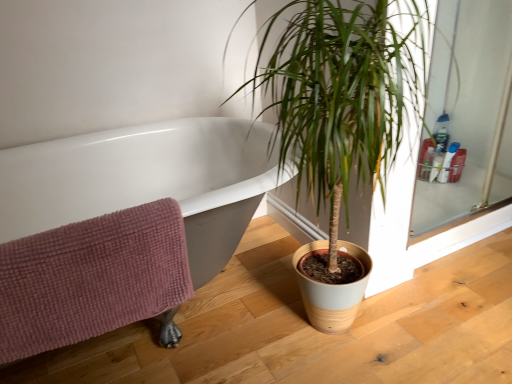
Question: Could you tell me if green leafy plant at center is facing translucent plastic bottles at upper right, the 2th toiletry in the right-to-left sequence?

Choices:
 (A) yes
 (B) no

Answer: (B)

Question: Would you say green leafy plant at center is a long distance from translucent plastic bottles at upper right, positioned as the second toiletry in left-to-right order?

Choices:
 (A) yes
 (B) no

Answer: (A)

Question: From a real-world perspective, is green leafy plant at center under translucent plastic bottles at upper right, the 2th toiletry in the right-to-left sequence?

Choices:
 (A) yes
 (B) no

Answer: (B)

Question: Is green leafy plant at center with translucent plastic bottles at upper right, the 2th toiletry in the right-to-left sequence?

Choices:
 (A) yes
 (B) no

Answer: (B)

Question: Does green leafy plant at center have a greater width compared to translucent plastic bottles at upper right, the 2th toiletry in the right-to-left sequence?

Choices:
 (A) no
 (B) yes

Answer: (B)

Question: Looking at the image, does translucent plastic bottles at upper right, acting as the third toiletry starting from the right, seem bigger or smaller compared to pink waffle-textured towel at lower left?

Choices:
 (A) big
 (B) small

Answer: (B)

Question: Does point (435, 160) appear closer or farther from the camera than point (164, 314)?

Choices:
 (A) farther
 (B) closer

Answer: (A)

Question: Considering their positions, is translucent plastic bottles at upper right, acting as the third toiletry starting from the right, located in front of or behind pink waffle-textured towel at lower left?

Choices:
 (A) front
 (B) behind

Answer: (B)

Question: In the image, is translucent plastic bottles at upper right, acting as the third toiletry starting from the right, on the left side or the right side of pink waffle-textured towel at lower left?

Choices:
 (A) left
 (B) right

Answer: (B)

Question: In terms of height, does translucent plastic bottles at upper right, acting as the third toiletry starting from the right, look taller or shorter compared to translucent plastic bottles at upper right, the 2th toiletry in the right-to-left sequence?

Choices:
 (A) short
 (B) tall

Answer: (A)

Question: Does point (440, 148) appear closer or farther from the camera than point (452, 153)?

Choices:
 (A) closer
 (B) farther

Answer: (B)

Question: In the image, is translucent plastic bottles at upper right, acting as the third toiletry starting from the right, on the left side or the right side of translucent plastic bottles at upper right, positioned as the second toiletry in left-to-right order?

Choices:
 (A) right
 (B) left

Answer: (B)

Question: From a real-world perspective, is translucent plastic bottles at upper right, arranged as the 1th toiletry when viewed from the left, physically located above or below translucent plastic bottles at upper right, the 2th toiletry in the right-to-left sequence?

Choices:
 (A) below
 (B) above

Answer: (B)

Question: Is translucent plastic bottle at upper right, which ranks as the 3th toiletry in left-to-right order, wider or thinner than green leafy plant at center?

Choices:
 (A) wide
 (B) thin

Answer: (B)

Question: Considering the positions of translucent plastic bottle at upper right, which is counted as the first toiletry, starting from the right, and green leafy plant at center in the image, is translucent plastic bottle at upper right, which is counted as the first toiletry, starting from the right, bigger or smaller than green leafy plant at center?

Choices:
 (A) big
 (B) small

Answer: (B)